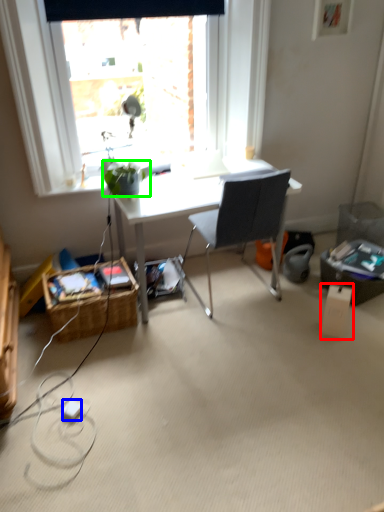
Question: Based on their relative distances, which object is farther from box (highlighted by a red box)? Choose from power outlet (highlighted by a blue box) and houseplant (highlighted by a green box).

Choices:
 (A) power outlet
 (B) houseplant

Answer: (A)